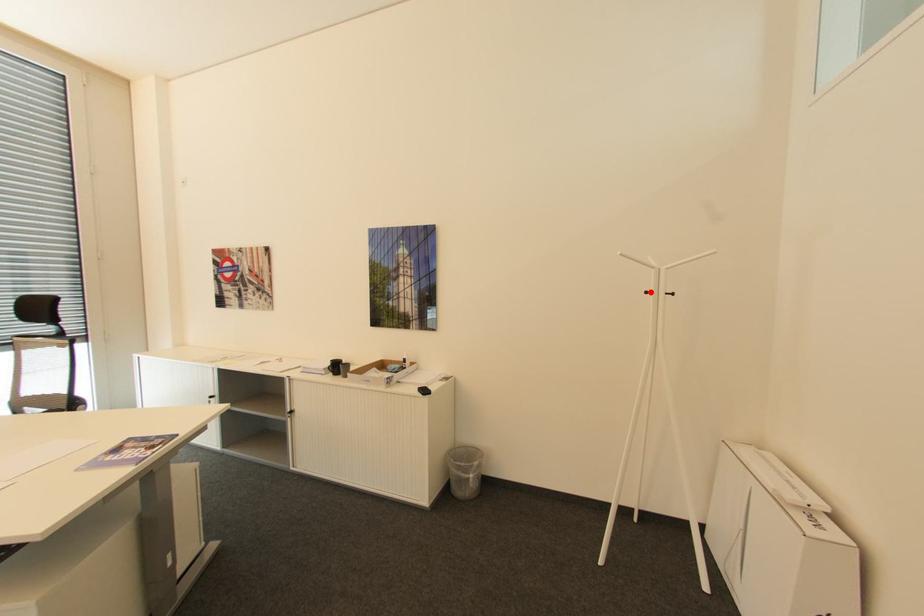
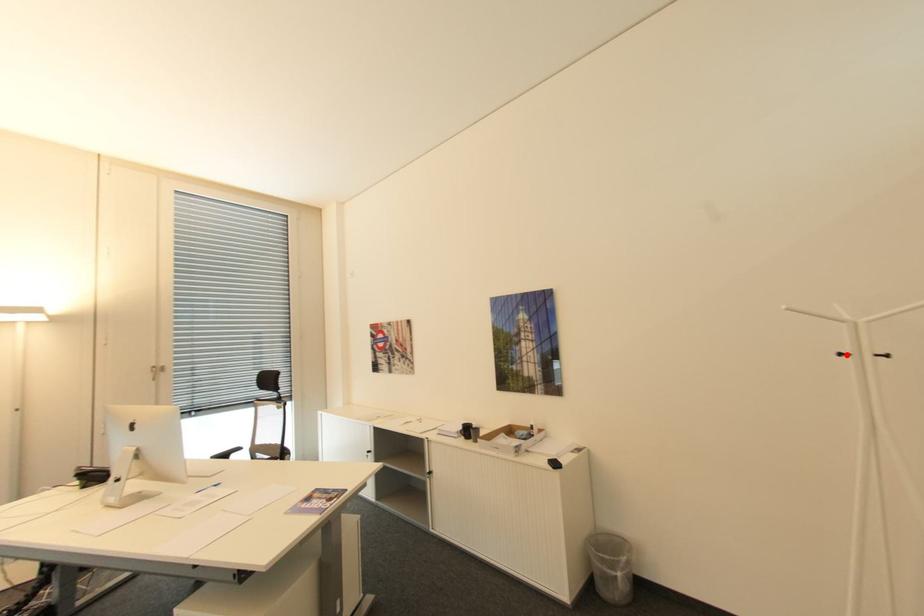
I am providing you with two images of the same scene from different viewpoints. A red point is marked on the first image and another point is marked on the second image. Is the red point in image1 aligned with the point shown in image2?

Yes